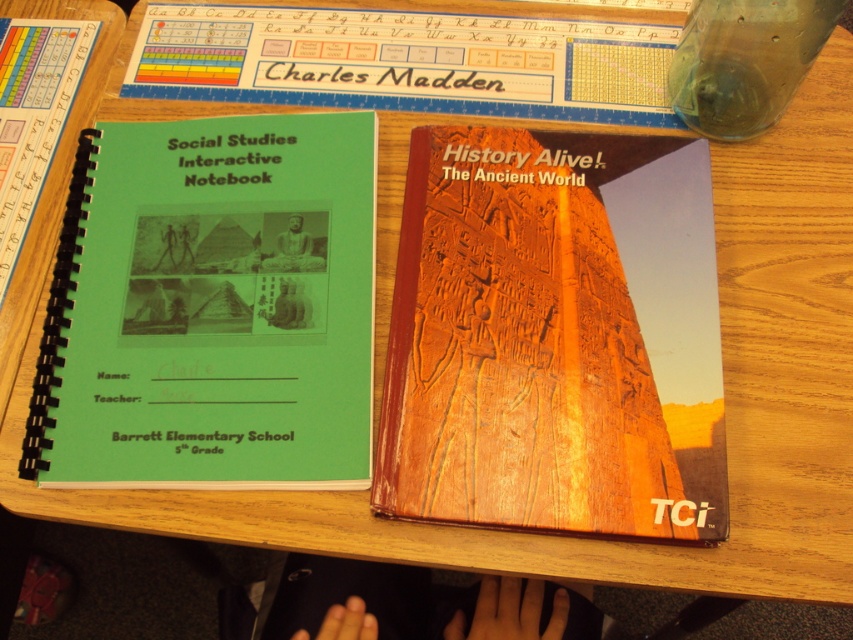
Which is more to the left, wooden history alive! book at center or transparent glass bottle at upper right?

From the viewer's perspective, wooden history alive! book at center appears more on the left side.

The image size is (853, 640). Describe the element at coordinates (555, 337) in the screenshot. I see `wooden history alive! book at center` at that location.

Where is wooden history alive! book at center located? Please provide its 2D coordinates.

[(555, 337)]

Does wooden history alive! book at center come in front of green matte social studies interactive notebook at left?

Yes, wooden history alive! book at center is closer to the viewer.

How much distance is there between wooden history alive! book at center and green matte social studies interactive notebook at left?

The distance of wooden history alive! book at center from green matte social studies interactive notebook at left is 4.86 inches.

Measure the distance between point (461, 467) and camera.

The distance of point (461, 467) from camera is 20.87 inches.

Select a point on the wooden history alive! book at center. Your answer should be formatted as a tuple, i.e. [(x, y)], where the tuple contains the x and y coordinates of a point satisfying the conditions above.

[(555, 337)]

Which is in front, point (296, 321) or point (740, 83)?

Positioned in front is point (296, 321).

Between green matte social studies interactive notebook at left and transparent glass bottle at upper right, which one is positioned higher?

transparent glass bottle at upper right is higher up.

This screenshot has width=853, height=640. Describe the element at coordinates (213, 308) in the screenshot. I see `green matte social studies interactive notebook at left` at that location.

Where is `green matte social studies interactive notebook at left`? green matte social studies interactive notebook at left is located at coordinates [x=213, y=308].